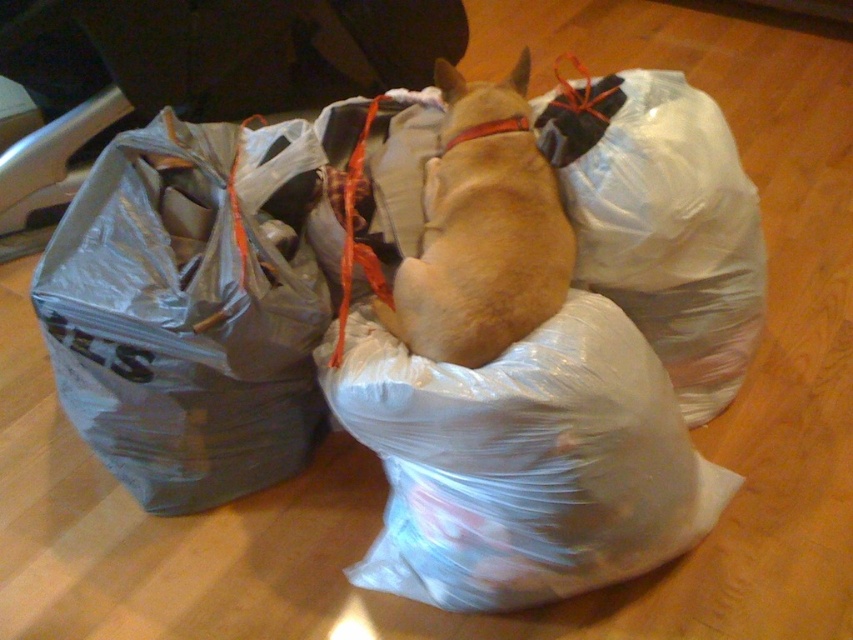
Can you confirm if gray plastic bag at left is wider than light brown fur at center?

Yes.

Is point (131, 392) less distant than point (437, 220)?

Yes, point (131, 392) is in front of point (437, 220).

Does point (175, 420) come farther from viewer compared to point (483, 115)?

No.

This screenshot has width=853, height=640. What are the coordinates of `gray plastic bag at left` in the screenshot? It's located at click(181, 323).

Is point (305, 353) positioned in front of point (613, 483)?

No, (305, 353) is further to viewer.

Does clear plastic bag at center appear on the left side of transparent plastic bag at center?

Indeed, clear plastic bag at center is positioned on the left side of transparent plastic bag at center.

The width and height of the screenshot is (853, 640). In order to click on clear plastic bag at center in this screenshot , I will do `click(419, 356)`.

Based on the photo, can you confirm if clear plastic bag at center is smaller than light brown fur at center?

No.

Is clear plastic bag at center taller than light brown fur at center?

Correct, clear plastic bag at center is much taller as light brown fur at center.

The image size is (853, 640). I want to click on clear plastic bag at center, so click(x=419, y=356).

I want to click on clear plastic bag at center, so click(419, 356).